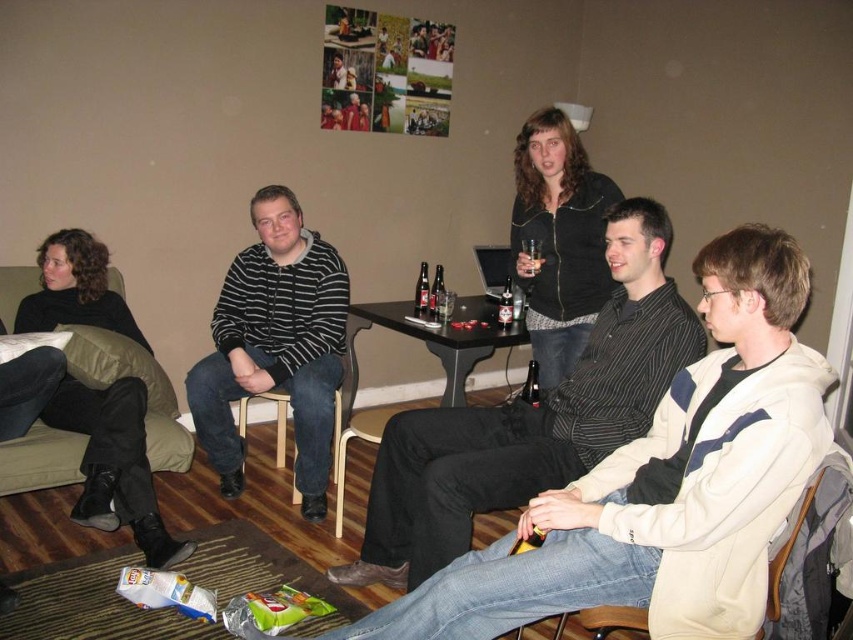
Measure the distance between point (x=813, y=497) and camera.

The distance of point (x=813, y=497) from camera is 5.18 feet.

Which is more to the right, beige fabric chair at lower right or matte glass beer at center table?

beige fabric chair at lower right

Does point (799, 504) come farther from viewer compared to point (419, 273)?

No, (799, 504) is in front of (419, 273).

Identify the location of beige fabric chair at lower right. (787, 552).

Can you confirm if black leather jacket at upper center is positioned above translucent glass beer bottle at center table?

No.

Does black leather jacket at upper center appear on the left side of translucent glass beer bottle at center table?

Incorrect, black leather jacket at upper center is not on the left side of translucent glass beer bottle at center table.

You are a GUI agent. You are given a task and a screenshot of the screen. Output one action in this format:
    pyautogui.click(x=<x>, y=<y>)
    Task: Click on the black leather jacket at upper center
    The height and width of the screenshot is (640, 853).
    Given the screenshot: What is the action you would take?
    pyautogui.click(x=558, y=240)

Image resolution: width=853 pixels, height=640 pixels. What are the coordinates of `black leather jacket at upper center` in the screenshot? It's located at [x=558, y=240].

Is striped hoodie at center further to the viewer compared to translucent glass beer at table center?

No, striped hoodie at center is in front of translucent glass beer at table center.

Between point (500, 502) and point (511, 298), which one is positioned in front?

Point (500, 502) is in front.

At what (x,y) coordinates should I click in order to perform the action: click on striped hoodie at center. Please return your answer as a coordinate pair (x, y). Looking at the image, I should click on (531, 419).

You are a GUI agent. You are given a task and a screenshot of the screen. Output one action in this format:
    pyautogui.click(x=<x>, y=<y>)
    Task: Click on the striped hoodie at center
    This screenshot has width=853, height=640.
    Given the screenshot: What is the action you would take?
    pyautogui.click(x=531, y=419)